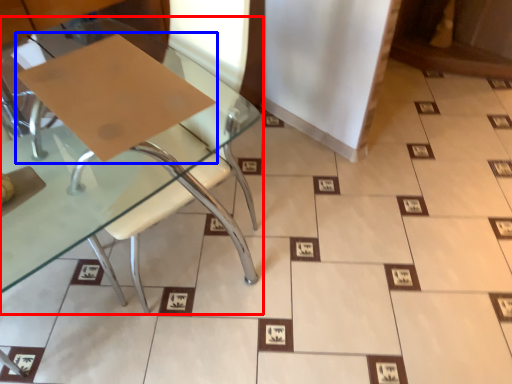
Question: Which of the following is the farthest to the observer, table (highlighted by a red box) or cardboard (highlighted by a blue box)?

Choices:
 (A) table
 (B) cardboard

Answer: (B)